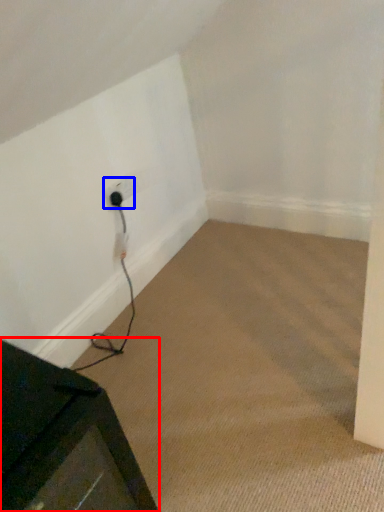
Question: Which point is further to the camera, furniture (highlighted by a red box) or electric outlet (highlighted by a blue box)?

Choices:
 (A) furniture
 (B) electric outlet

Answer: (B)